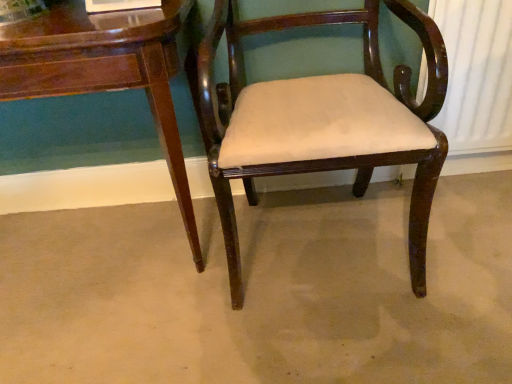
Question: Is the position of mahogany wood chair at center less distant than that of brown wood chair at center?

Choices:
 (A) yes
 (B) no

Answer: (A)

Question: Is mahogany wood chair at center turned away from brown wood chair at center?

Choices:
 (A) no
 (B) yes

Answer: (A)

Question: Is mahogany wood chair at center oriented towards brown wood chair at center?

Choices:
 (A) no
 (B) yes

Answer: (A)

Question: Is mahogany wood chair at center bigger than brown wood chair at center?

Choices:
 (A) yes
 (B) no

Answer: (A)

Question: Is mahogany wood chair at center outside brown wood chair at center?

Choices:
 (A) yes
 (B) no

Answer: (A)

Question: Is mahogany wood chair at center behind brown wood chair at center?

Choices:
 (A) yes
 (B) no

Answer: (B)

Question: Considering the relative positions of mahogany wood chair at center and glossy wood table at lower left in the image provided, is mahogany wood chair at center behind glossy wood table at lower left?

Choices:
 (A) no
 (B) yes

Answer: (A)

Question: Does mahogany wood chair at center have a greater width compared to glossy wood table at lower left?

Choices:
 (A) yes
 (B) no

Answer: (A)

Question: From a real-world perspective, does mahogany wood chair at center sit lower than glossy wood table at lower left?

Choices:
 (A) no
 (B) yes

Answer: (A)

Question: Is mahogany wood chair at center aimed at glossy wood table at lower left?

Choices:
 (A) no
 (B) yes

Answer: (A)

Question: Is mahogany wood chair at center oriented away from glossy wood table at lower left?

Choices:
 (A) yes
 (B) no

Answer: (B)

Question: Is mahogany wood chair at center surrounding glossy wood table at lower left?

Choices:
 (A) yes
 (B) no

Answer: (B)

Question: Is glossy wood table at lower left facing away from mahogany wood chair at center?

Choices:
 (A) yes
 (B) no

Answer: (B)